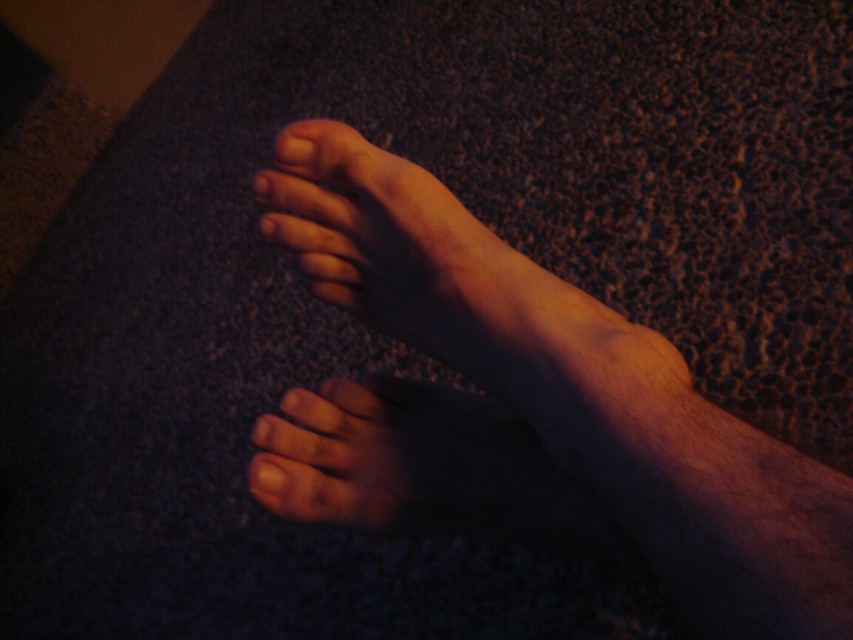
Question: Can you confirm if dry skin at lower left is positioned to the right of matte skin toe at upper center?

Choices:
 (A) yes
 (B) no

Answer: (A)

Question: Which point is farther to the camera?

Choices:
 (A) (695, 444)
 (B) (366, 157)
 (C) (288, 403)

Answer: (C)

Question: Is the position of skinny bare feet at center more distant than that of dry skin at lower left?

Choices:
 (A) yes
 (B) no

Answer: (B)

Question: Considering the relative positions of skinny bare feet at center and dry skin at lower left in the image provided, where is skinny bare feet at center located with respect to dry skin at lower left?

Choices:
 (A) above
 (B) below

Answer: (A)

Question: Which object is the closest to the skinny bare feet at center?

Choices:
 (A) dry skin at lower left
 (B) matte skin toe at upper center

Answer: (A)

Question: Which point appears farthest from the camera in this image?

Choices:
 (A) (329, 154)
 (B) (444, 321)
 (C) (431, 392)

Answer: (C)